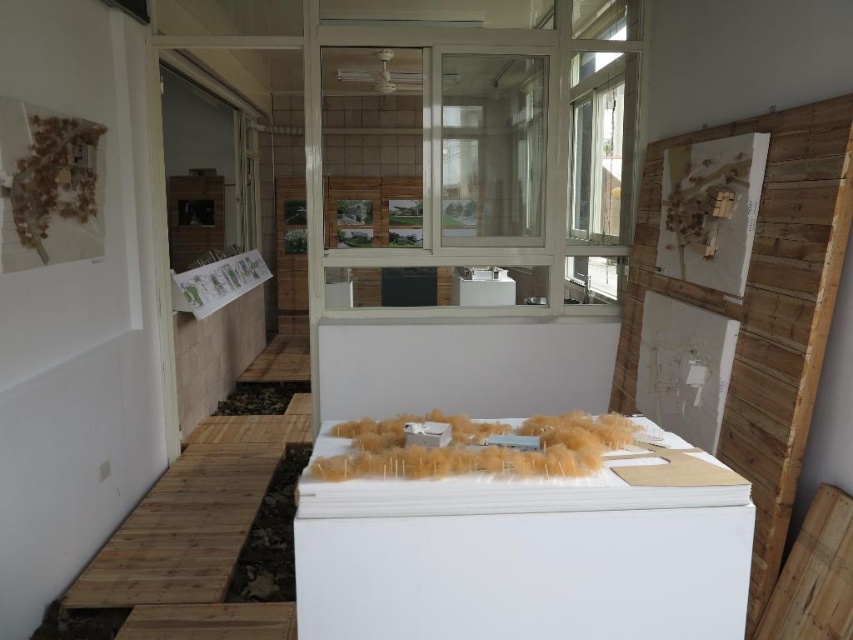
Which of these two, white foam model at center or white glossy refrigerator at center, stands taller?

white foam model at center is taller.

Can you confirm if white foam model at center is wider than white glossy refrigerator at center?

Indeed, white foam model at center has a greater width compared to white glossy refrigerator at center.

What do you see at coordinates (521, 541) in the screenshot? This screenshot has width=853, height=640. I see `white foam model at center` at bounding box center [521, 541].

Image resolution: width=853 pixels, height=640 pixels. In order to click on white foam model at center in this screenshot , I will do `click(521, 541)`.